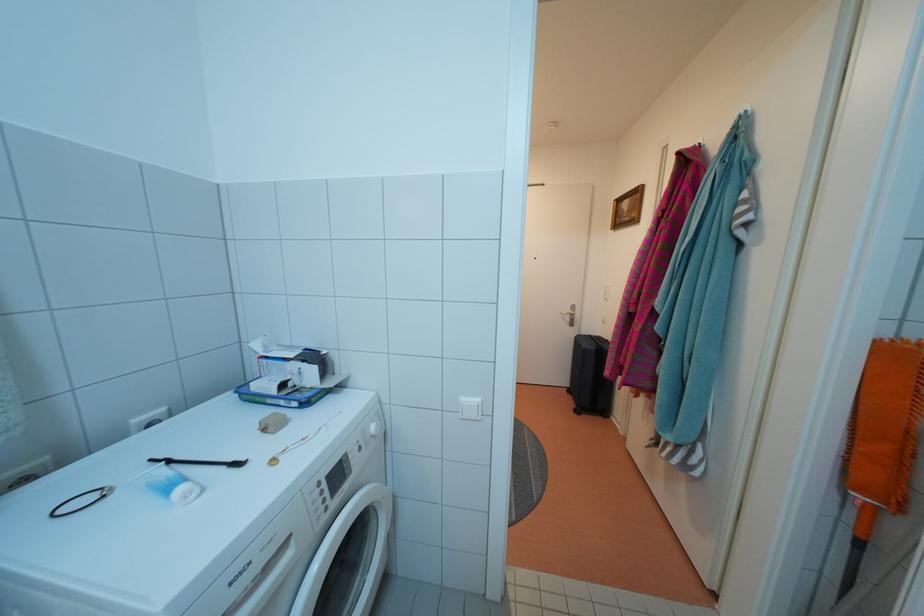
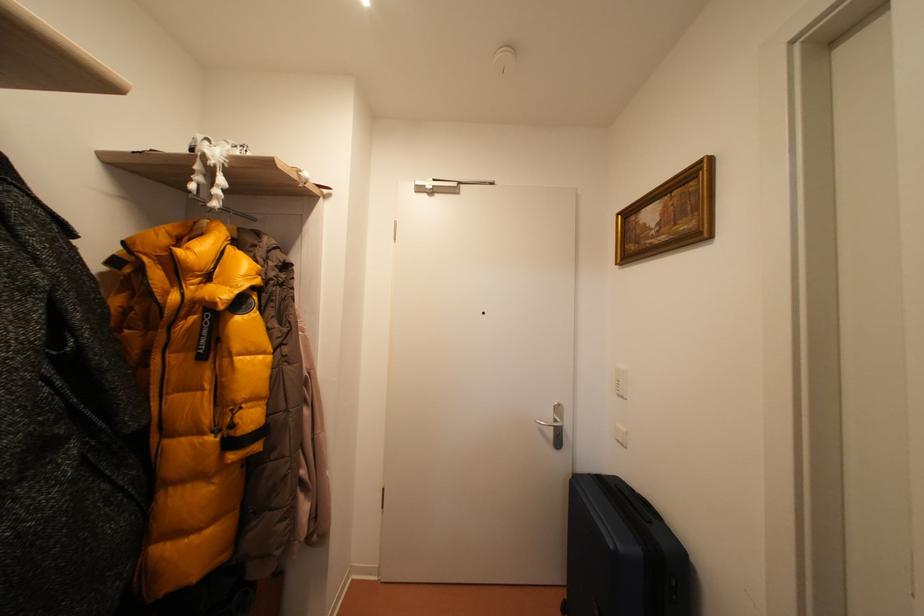
Question: What movement of the cameraman would produce the second image?

Choices:
 (A) Left
 (B) Right
 (C) Forward
 (D) Backward

Answer: (C)